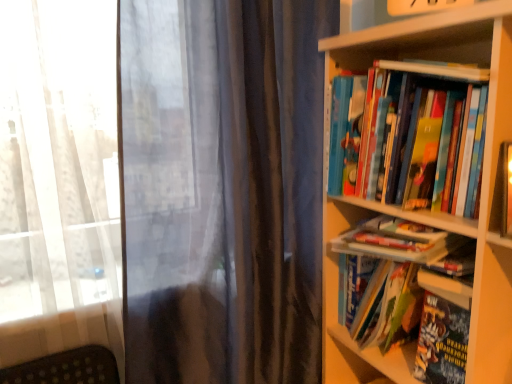
Where is `hardcover book at right, the 1th book ordered from the bottom`? The width and height of the screenshot is (512, 384). hardcover book at right, the 1th book ordered from the bottom is located at coordinates (442, 342).

The height and width of the screenshot is (384, 512). I want to click on hardcover books at right, which appears as the first book when viewed from the top, so click(x=415, y=137).

Locate an element on the screen. hardcover book at center, the fourth book positioned from the top is located at coordinates (388, 307).

Locate an element on the screen. This screenshot has width=512, height=384. hardcover book at right, the 3th book viewed from the top is located at coordinates (390, 298).

Is hardcover book at center, the 2th book ordered from the bottom, facing towards hardcover books at right, the 5th book in the bottom-to-top sequence?

No, hardcover book at center, the 2th book ordered from the bottom, is not facing towards hardcover books at right, the 5th book in the bottom-to-top sequence.

In the scene shown: Which object is further away from the camera, hardcover book at center, the fourth book positioned from the top, or hardcover books at right, the 5th book in the bottom-to-top sequence?

hardcover book at center, the fourth book positioned from the top.

In the scene shown: From their relative heights in the image, would you say hardcover book at center, the 2th book ordered from the bottom, is taller or shorter than hardcover books at right, the 5th book in the bottom-to-top sequence?

In the image, hardcover book at center, the 2th book ordered from the bottom, appears to be shorter than hardcover books at right, the 5th book in the bottom-to-top sequence.

Which of these two, hardcover book at center, the fourth book positioned from the top, or hardcover books at right, the 5th book in the bottom-to-top sequence, is thinner?

hardcover book at center, the fourth book positioned from the top, is thinner.

From a real-world perspective, is hardcover book at center right, the 4th book ordered from the bottom, beneath hardcover books at right, the 5th book in the bottom-to-top sequence?

Correct, in the physical world, hardcover book at center right, the 4th book ordered from the bottom, is lower than hardcover books at right, the 5th book in the bottom-to-top sequence.

Is hardcover book at center right, the 4th book ordered from the bottom, next to hardcover books at right, which appears as the first book when viewed from the top, and touching it?

No, hardcover book at center right, the 4th book ordered from the bottom, is not in contact with hardcover books at right, which appears as the first book when viewed from the top.

Based on their positions, is hardcover book at center right, the 4th book ordered from the bottom, located to the left or right of hardcover books at right, the 5th book in the bottom-to-top sequence?

hardcover book at center right, the 4th book ordered from the bottom, is to the left of hardcover books at right, the 5th book in the bottom-to-top sequence.

From the image's perspective, is hardcover book at center right, the 4th book ordered from the bottom, above hardcover books at right, the 5th book in the bottom-to-top sequence?

Incorrect, from the image's perspective, hardcover book at center right, the 4th book ordered from the bottom, is lower than hardcover books at right, the 5th book in the bottom-to-top sequence.

Is white matte bookshelf at right turned away from hardcover book at right, arranged as the third book when ordered from the bottom?

Yes, hardcover book at right, arranged as the third book when ordered from the bottom, is at the back of white matte bookshelf at right.

Find the location of a particular element. This screenshot has width=512, height=384. the 2nd book counting from the right side of the white matte bookshelf at right is located at coordinates coord(390,298).

Measure the distance from white matte bookshelf at right to hardcover book at right, the 3th book viewed from the top.

white matte bookshelf at right is 5.68 inches away from hardcover book at right, the 3th book viewed from the top.

Which object is more forward, white matte bookshelf at right or hardcover book at right, the 3th book viewed from the top?

white matte bookshelf at right is closer to the camera.

Is hardcover book at right, arranged as the third book when ordered from the bottom, not inside hardcover books at right, the 5th book in the bottom-to-top sequence?

Yes, hardcover book at right, arranged as the third book when ordered from the bottom, is not within hardcover books at right, the 5th book in the bottom-to-top sequence.

Between hardcover book at right, arranged as the third book when ordered from the bottom, and hardcover books at right, which appears as the first book when viewed from the top, which one has more height?

Standing taller between the two is hardcover book at right, arranged as the third book when ordered from the bottom.

Based on the photo, from a real-world perspective, is hardcover book at right, arranged as the third book when ordered from the bottom, physically below hardcover books at right, the 5th book in the bottom-to-top sequence?

Yes, from a real-world perspective, hardcover book at right, arranged as the third book when ordered from the bottom, is under hardcover books at right, the 5th book in the bottom-to-top sequence.

How far apart are hardcover book at center right, the 2th book viewed from the top, and hardcover book at right, the 3th book viewed from the top?

The distance of hardcover book at center right, the 2th book viewed from the top, from hardcover book at right, the 3th book viewed from the top, is 3.68 inches.

From their relative heights in the image, would you say hardcover book at center right, the 2th book viewed from the top, is taller or shorter than hardcover book at right, arranged as the third book when ordered from the bottom?

Considering their sizes, hardcover book at center right, the 2th book viewed from the top, has less height than hardcover book at right, arranged as the third book when ordered from the bottom.

Consider the image. From the image's perspective, between hardcover book at center right, the 2th book viewed from the top, and hardcover book at right, arranged as the third book when ordered from the bottom, who is located below?

hardcover book at right, arranged as the third book when ordered from the bottom, from the image's perspective.

Could you tell me if hardcover book at center right, the 4th book ordered from the bottom, is turned towards hardcover book at right, the 3th book viewed from the top?

Yes, hardcover book at center right, the 4th book ordered from the bottom, faces towards hardcover book at right, the 3th book viewed from the top.

Is hardcover book at right, the 3th book viewed from the top, aimed at hardcover book at center right, the 4th book ordered from the bottom?

Yes.

Is hardcover book at right, arranged as the third book when ordered from the bottom, positioned far away from hardcover book at center right, the 2th book viewed from the top?

Actually, hardcover book at right, arranged as the third book when ordered from the bottom, and hardcover book at center right, the 2th book viewed from the top, are a little close together.

Is hardcover book at right, the 3th book viewed from the top, situated inside hardcover book at center right, the 4th book ordered from the bottom, or outside?

hardcover book at right, the 3th book viewed from the top, is not enclosed by hardcover book at center right, the 4th book ordered from the bottom.

Considering the positions of points (416, 262) and (436, 247), is point (416, 262) closer to camera compared to point (436, 247)?

No, (416, 262) is further to viewer.

Looking at this image, is hardcover book at right, arranged as the third book when ordered from the bottom, in front of or behind hardcover book at center, the fourth book positioned from the top, in the image?

In the image, hardcover book at right, arranged as the third book when ordered from the bottom, appears in front of hardcover book at center, the fourth book positioned from the top.

From a real-world perspective, between hardcover book at right, the 3th book viewed from the top, and hardcover book at center, the 2th book ordered from the bottom, who is vertically lower?

hardcover book at center, the 2th book ordered from the bottom, is physically lower.

Is point (407, 287) farther from viewer compared to point (419, 317)?

No.

Based on the photo, can you tell me how much hardcover book at right, arranged as the third book when ordered from the bottom, and hardcover book at center, the fourth book positioned from the top, differ in facing direction?

There is a 1.15-degree angle between the facing directions of hardcover book at right, arranged as the third book when ordered from the bottom, and hardcover book at center, the fourth book positioned from the top.

From a real-world perspective, starting from the hardcover books at right, the 5th book in the bottom-to-top sequence, which book is the 3rd one below it? Please provide its 2D coordinates.

[(388, 307)]

There is a hardcover book at center right, the 4th book ordered from the bottom. Identify the location of book above it (from a real-world perspective). (415, 137).

Which object lies further to the anchor point hardcover book at right, the 1th book ordered from the bottom, white matte bookshelf at right or hardcover book at center, the fourth book positioned from the top?

white matte bookshelf at right is further to hardcover book at right, the 1th book ordered from the bottom.

Considering their positions, is hardcover book at right, the 3th book viewed from the top, positioned further to hardcover book at right, the 1th book ordered from the bottom, than white matte bookshelf at right?

white matte bookshelf at right is positioned further to the anchor hardcover book at right, the 1th book ordered from the bottom.

Looking at the image, which one is located closer to white matte bookshelf at right, hardcover books at right, which appears as the first book when viewed from the top, or hardcover book at center, the fourth book positioned from the top?

Answer: Among the two, hardcover books at right, which appears as the first book when viewed from the top, is located nearer to white matte bookshelf at right.

Estimate the real-world distances between objects in this image. Which object is closer to hardcover book at center, the 2th book ordered from the bottom, hardcover book at right, which ranks as the fifth book in top-to-bottom order, or hardcover book at right, arranged as the third book when ordered from the bottom?

hardcover book at right, arranged as the third book when ordered from the bottom, is positioned closer to the anchor hardcover book at center, the 2th book ordered from the bottom.

Based on their spatial positions, is white matte bookshelf at right or hardcover book at center right, the 2th book viewed from the top, closer to hardcover book at right, which ranks as the fifth book in top-to-bottom order?

The object closer to hardcover book at right, which ranks as the fifth book in top-to-bottom order, is hardcover book at center right, the 2th book viewed from the top.

Which object lies nearer to the anchor point hardcover books at right, which appears as the first book when viewed from the top, hardcover book at center, the fourth book positioned from the top, or white matte bookshelf at right?

white matte bookshelf at right.

Looking at this image, looking at the image, which one is located closer to hardcover book at center, the 2th book ordered from the bottom, white matte bookshelf at right or hardcover book at right, the 1th book ordered from the bottom?

Based on the image, hardcover book at right, the 1th book ordered from the bottom, appears to be nearer to hardcover book at center, the 2th book ordered from the bottom.

Consider the image. When comparing their distances from hardcover book at right, which ranks as the fifth book in top-to-bottom order, does hardcover book at center right, the 4th book ordered from the bottom, or hardcover book at right, the 3th book viewed from the top, seem further?

Among the two, hardcover book at center right, the 4th book ordered from the bottom, is located further to hardcover book at right, which ranks as the fifth book in top-to-bottom order.

Find the location of a particular element. bookcase between hardcover books at right, which appears as the first book when viewed from the top, and hardcover book at right, the 3th book viewed from the top, in the vertical direction is located at coordinates (431, 58).

You are a GUI agent. You are given a task and a screenshot of the screen. Output one action in this format:
    pyautogui.click(x=<x>, y=<y>)
    Task: Click on the book between hardcover books at right, the 5th book in the bottom-to-top sequence, and hardcover book at right, arranged as the third book when ordered from the bottom, in the up-down direction
    The image size is (512, 384).
    Given the screenshot: What is the action you would take?
    pyautogui.click(x=410, y=245)